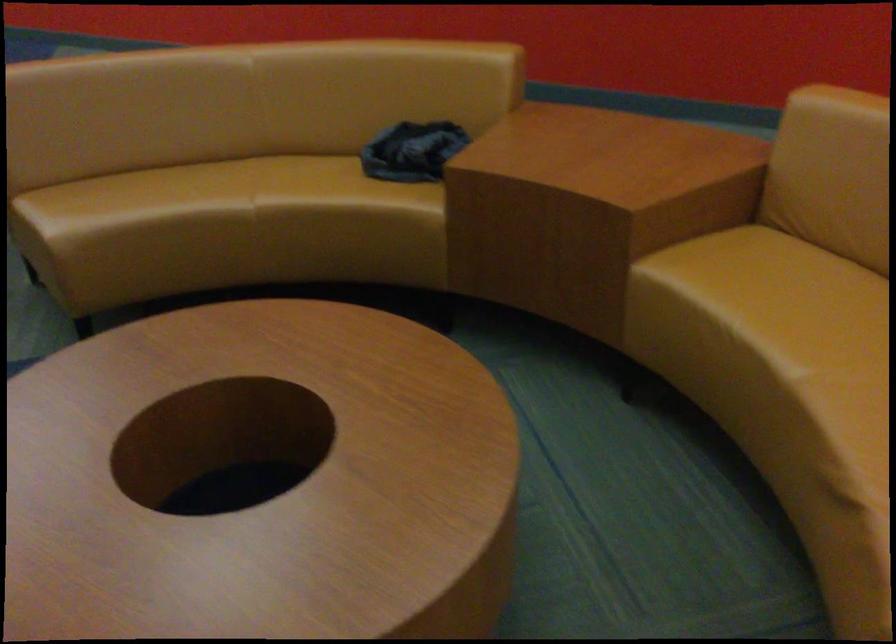
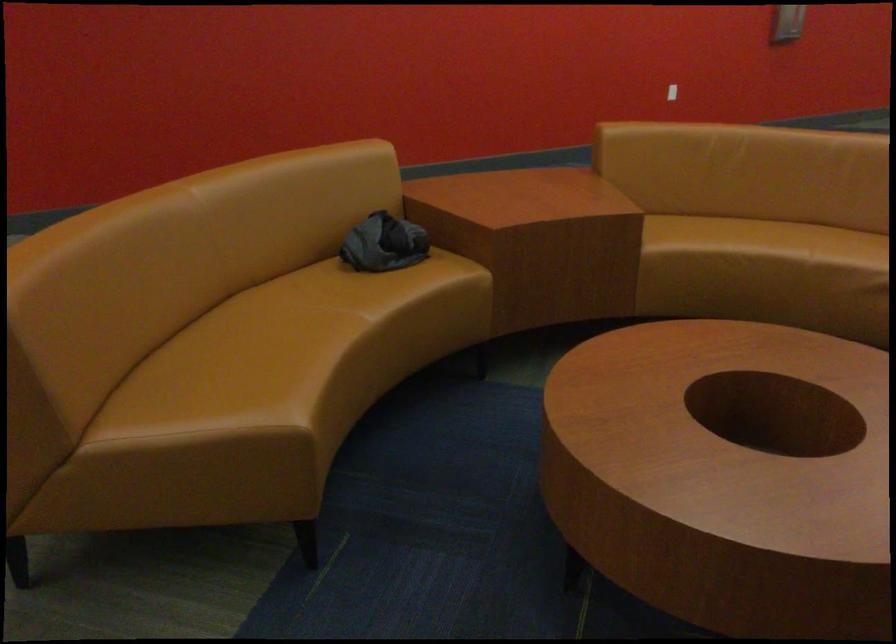
In the second image, find the point that corresponds to pixel 205 187 in the first image.

(271, 336)